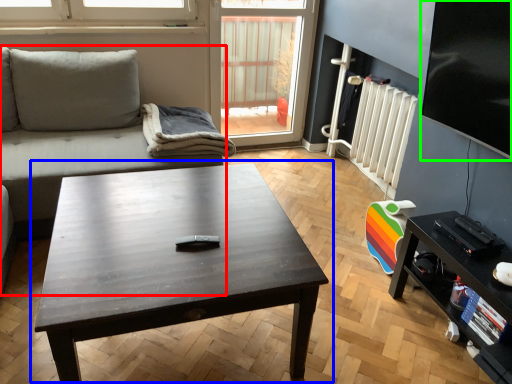
Question: Considering the real-world distances, which object is closest to studio couch (highlighted by a red box)? coffee table (highlighted by a blue box) or window screen (highlighted by a green box).

Choices:
 (A) coffee table
 (B) window screen

Answer: (A)